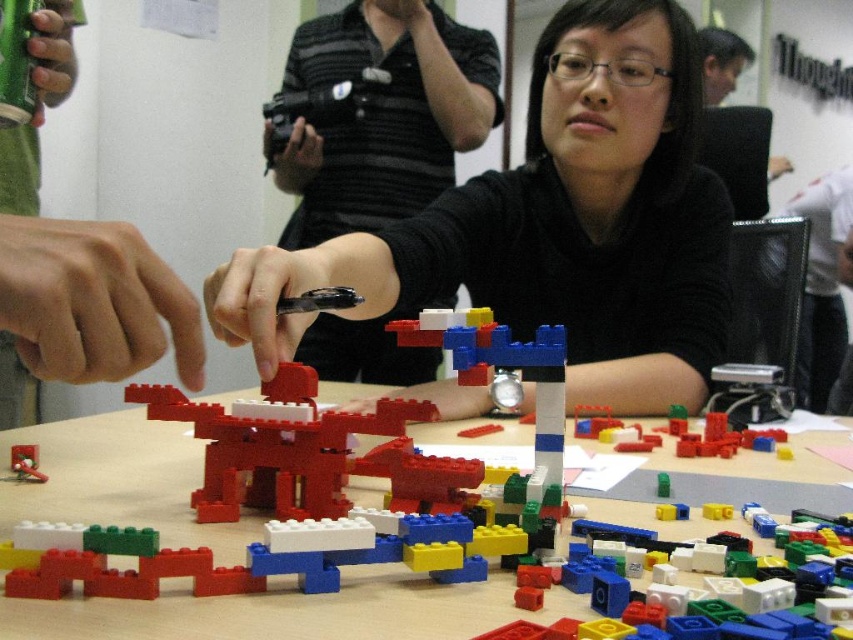
Does black matte shirt at center appear over black mesh chair at right?

No, black matte shirt at center is not above black mesh chair at right.

Who is positioned more to the right, black matte shirt at center or black mesh chair at right?

black mesh chair at right

Which is behind, point (691, 380) or point (845, 228)?

Point (845, 228)

I want to click on black matte shirt at center, so click(x=550, y=227).

Is matte black camera at upper center thinner than smooth red toy at center?

Incorrect, matte black camera at upper center's width is not less than smooth red toy at center's.

Looking at this image, is matte black camera at upper center shorter than smooth red toy at center?

No, matte black camera at upper center is not shorter than smooth red toy at center.

The image size is (853, 640). I want to click on matte black camera at upper center, so click(384, 115).

Which is behind, point (554, 180) or point (68, 372)?

The point (554, 180) is behind.

Who is more distant from viewer, (653, 310) or (39, 232)?

The point (653, 310) is more distant.

You are a GUI agent. You are given a task and a screenshot of the screen. Output one action in this format:
    pyautogui.click(x=<x>, y=<y>)
    Task: Click on the black matte shirt at center
    The height and width of the screenshot is (640, 853).
    Given the screenshot: What is the action you would take?
    pyautogui.click(x=550, y=227)